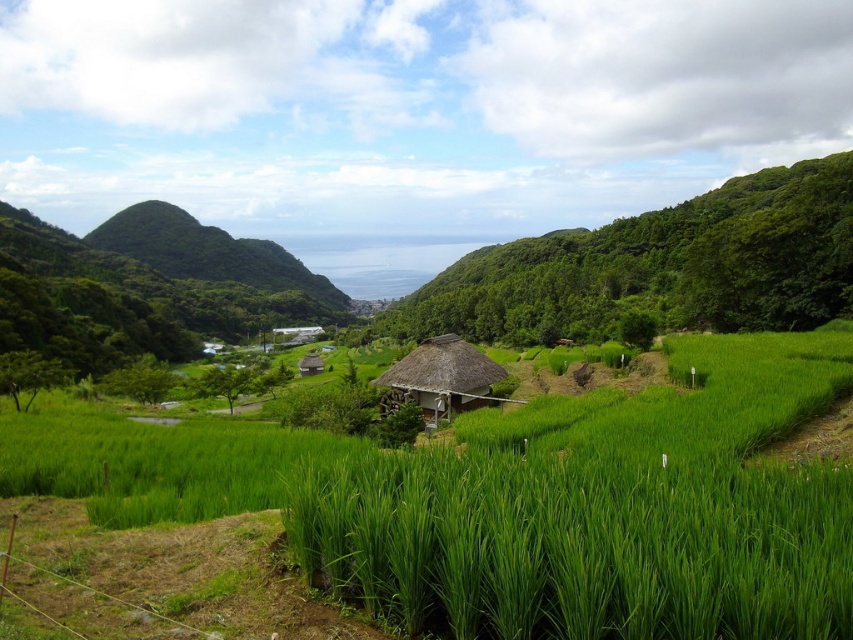
Who is lower down, green grass at center or thatched roof hut at center?

Positioned lower is thatched roof hut at center.

Describe the element at coordinates (527, 502) in the screenshot. I see `green grass at center` at that location.

Does point (74, 448) lie behind point (425, 381)?

No, it is in front of (425, 381).

Find the location of a particular element. green grass at center is located at coordinates (527, 502).